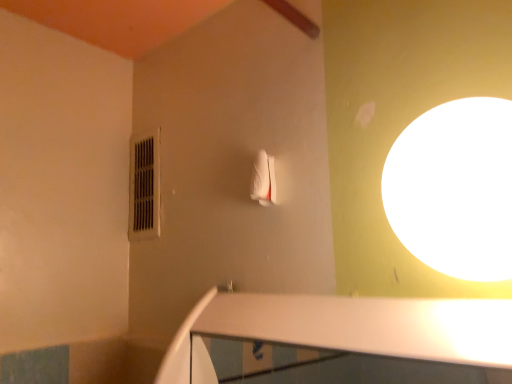
Question: From their relative heights in the image, would you say black plastic air conditioner at upper left is taller or shorter than white glossy light at upper right?

Choices:
 (A) tall
 (B) short

Answer: (A)

Question: Relative to white glossy light at upper right, is black plastic air conditioner at upper left in front or behind?

Choices:
 (A) front
 (B) behind

Answer: (B)

Question: Does point (153, 185) appear closer or farther from the camera than point (462, 233)?

Choices:
 (A) closer
 (B) farther

Answer: (B)

Question: Is white glossy light at upper right inside or outside of black plastic air conditioner at upper left?

Choices:
 (A) outside
 (B) inside

Answer: (A)

Question: Based on their positions, is white glossy light at upper right located to the left or right of black plastic air conditioner at upper left?

Choices:
 (A) right
 (B) left

Answer: (A)

Question: From the image's perspective, is white glossy light at upper right above or below black plastic air conditioner at upper left?

Choices:
 (A) below
 (B) above

Answer: (A)

Question: In terms of height, does white glossy light at upper right look taller or shorter compared to black plastic air conditioner at upper left?

Choices:
 (A) short
 (B) tall

Answer: (A)